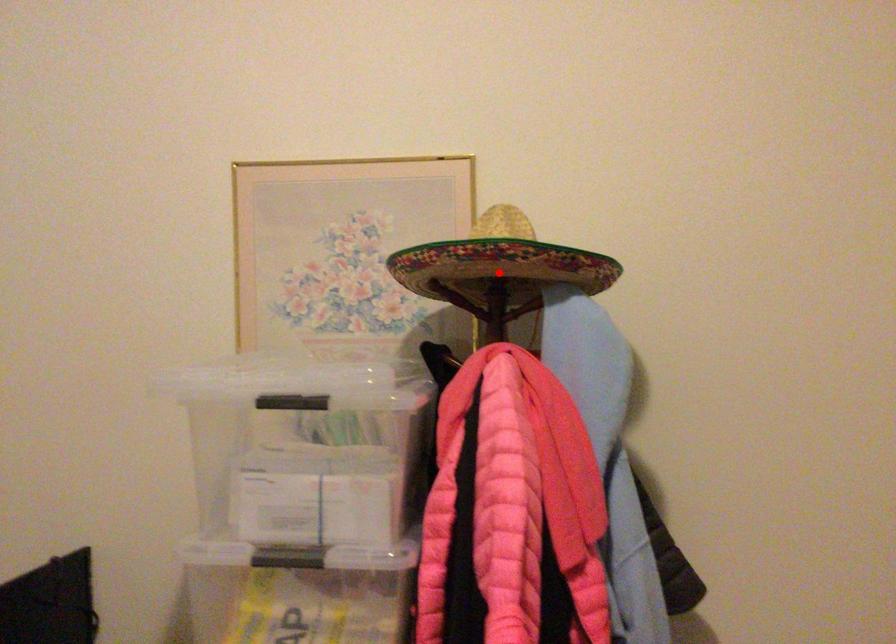
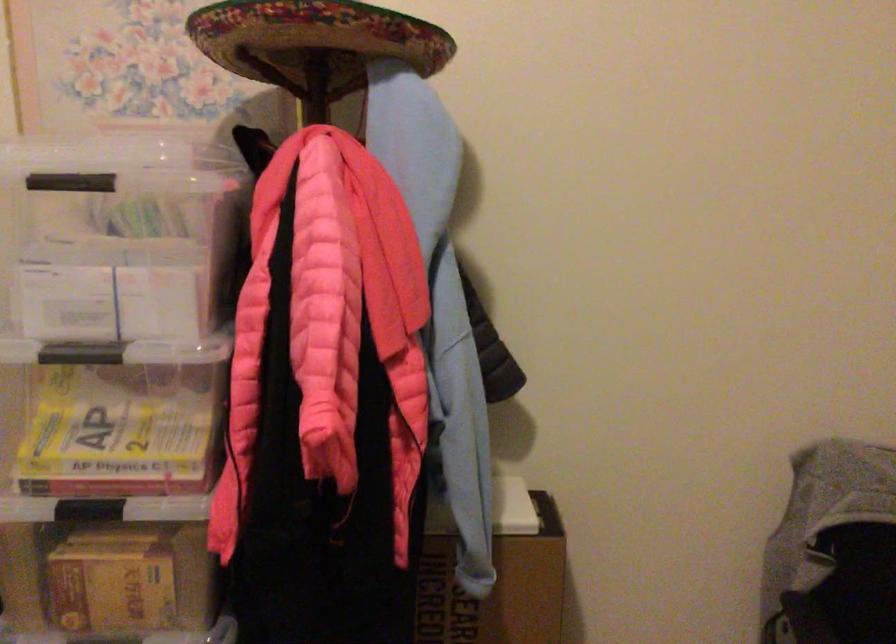
Where in the second image is the point corresponding to the highlighted location from the first image?

(314, 40)